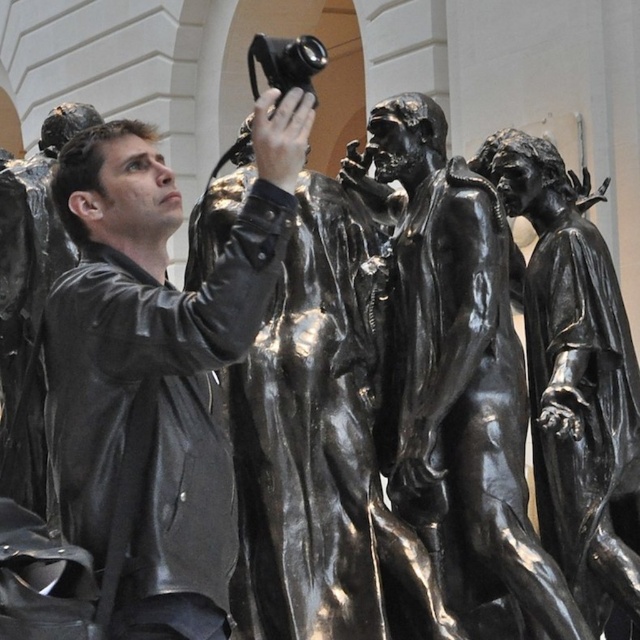
You are a photographer standing in front of the black leather jacket at center and the black polished bronze figures at center. You want to capture a photo where both the jacket and the figures are clearly visible. Which object should you focus on first to ensure proper depth of field?

The black leather jacket at center has a lesser height compared to the black polished bronze figures at center, so you should focus on the black polished bronze figures at center first since they are taller and will require more attention to ensure both are in focus.

You are standing in front of the statues and notice the black leather jacket at center and the shiny bronze statue at center. Which object is nearer to you?

The black leather jacket at center is closer to the viewer than the shiny bronze statue at center.